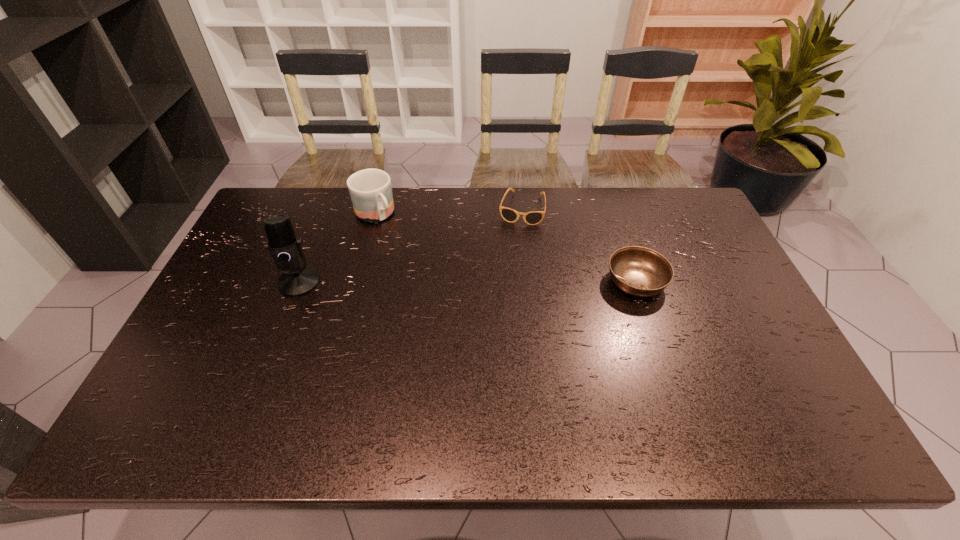
Locate an element on the screen. free area in between the mug and the leftmost object is located at coordinates (337, 248).

Locate an element on the screen. The height and width of the screenshot is (540, 960). free space between the soup bowl and the sunglasses is located at coordinates (579, 245).

Image resolution: width=960 pixels, height=540 pixels. Find the location of `free space between the sunglasses and the tallest object`. free space between the sunglasses and the tallest object is located at coordinates (410, 245).

I want to click on free area in between the tallest object and the sunglasses, so click(410, 245).

Where is `vacant area that lies between the second object from right to left and the mug`? vacant area that lies between the second object from right to left and the mug is located at coordinates (448, 211).

You are a GUI agent. You are given a task and a screenshot of the screen. Output one action in this format:
    pyautogui.click(x=<x>, y=<y>)
    Task: Click on the vacant area between the tallest object and the rightmost object
    
    Given the screenshot: What is the action you would take?
    pyautogui.click(x=468, y=282)

The width and height of the screenshot is (960, 540). I want to click on empty space between the tallest object and the rightmost object, so click(468, 282).

You are a GUI agent. You are given a task and a screenshot of the screen. Output one action in this format:
    pyautogui.click(x=<x>, y=<y>)
    Task: Click on the free space between the soup bowl and the microphone
    Image resolution: width=960 pixels, height=540 pixels.
    Given the screenshot: What is the action you would take?
    pyautogui.click(x=468, y=282)

Image resolution: width=960 pixels, height=540 pixels. Find the location of `blank region between the sunglasses and the soup bowl`. blank region between the sunglasses and the soup bowl is located at coordinates (579, 245).

Locate an element on the screen. This screenshot has width=960, height=540. free space that is in between the microphone and the second object from left to right is located at coordinates (337, 248).